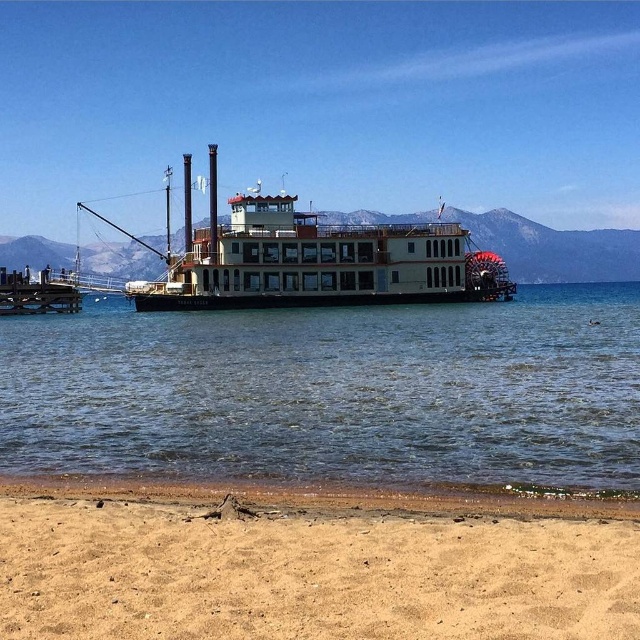
You are standing on the shore and want to take a photo of the white wooden paddlewheel boat at center. Which object, the tan sandy beach at lower center or the boat, will appear larger in your photo?

The tan sandy beach at lower center will appear larger in the photo because it is closer to the viewer than the white wooden paddlewheel boat at center.

You are standing on the sandy beach looking at the paddlewheel boat. There are two points marked on the image. Which point, point (x=509, y=548) or point (x=48, y=280), is closer to you?

Point (x=509, y=548) is closer to you than point (x=48, y=280).